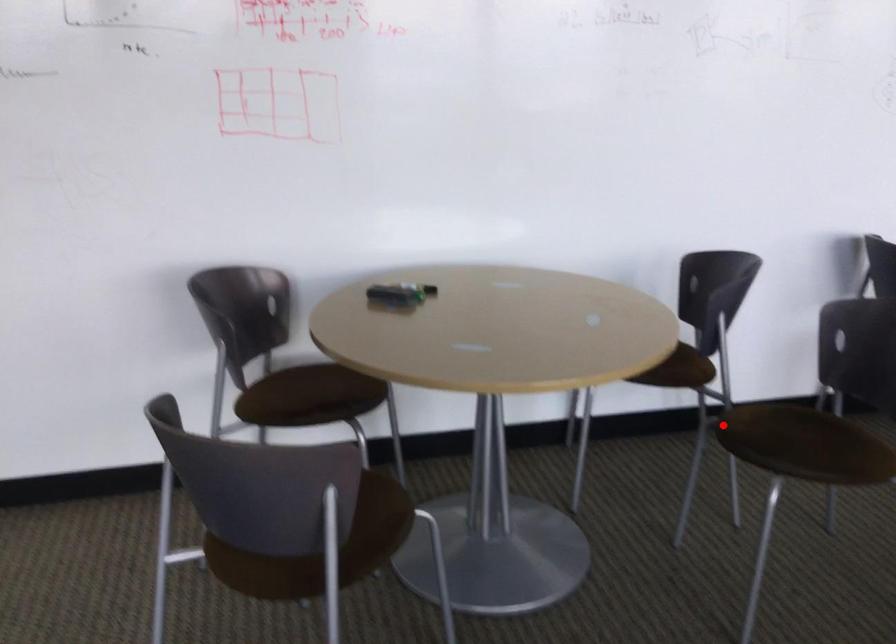
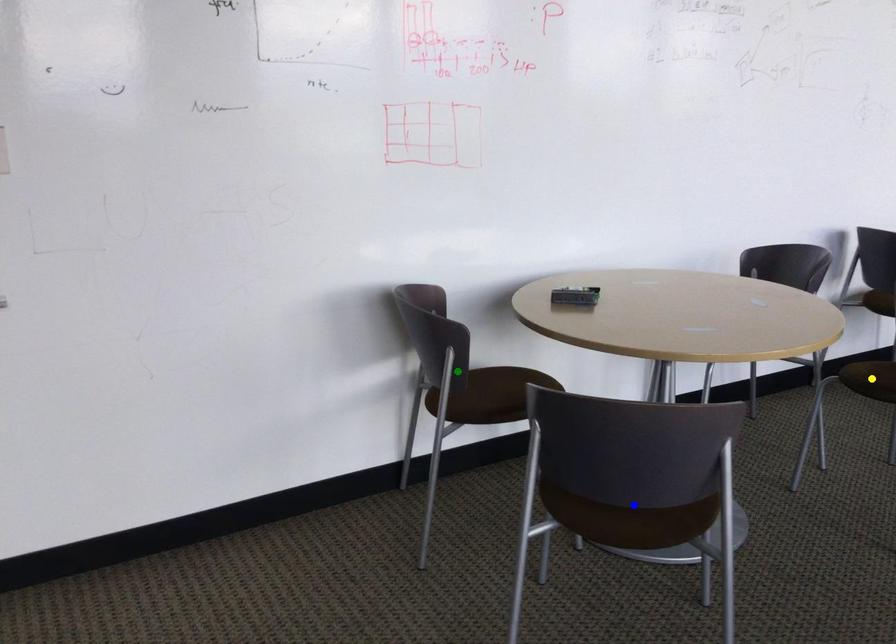
Question: I am providing you with two images of the same scene from different viewpoints. A red point is marked on the first image. You are given multiple points on the second image. Which point in image 2 is actually the same real-world point as the red point in image 1?

Choices:
 (A) blue point
 (B) yellow point
 (C) green point

Answer: (B)